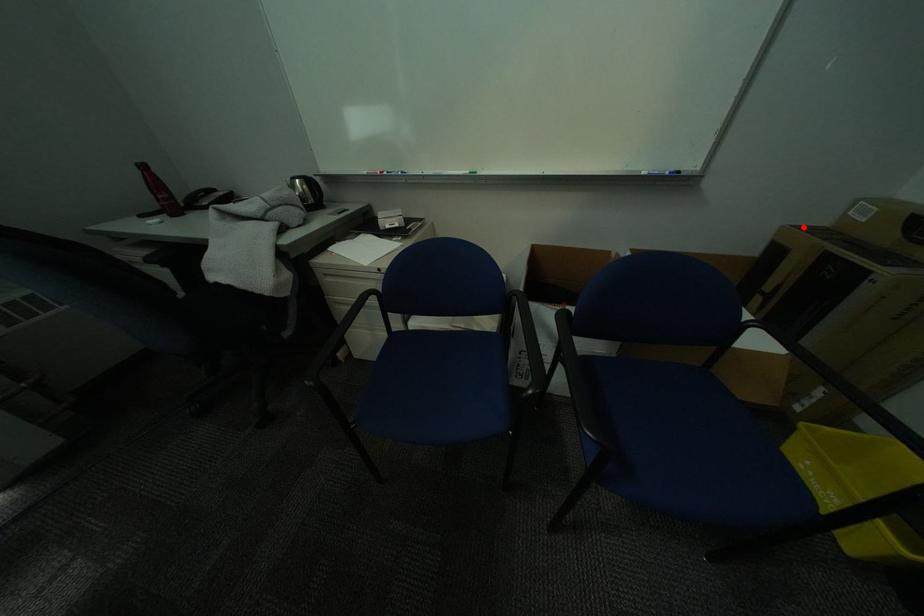
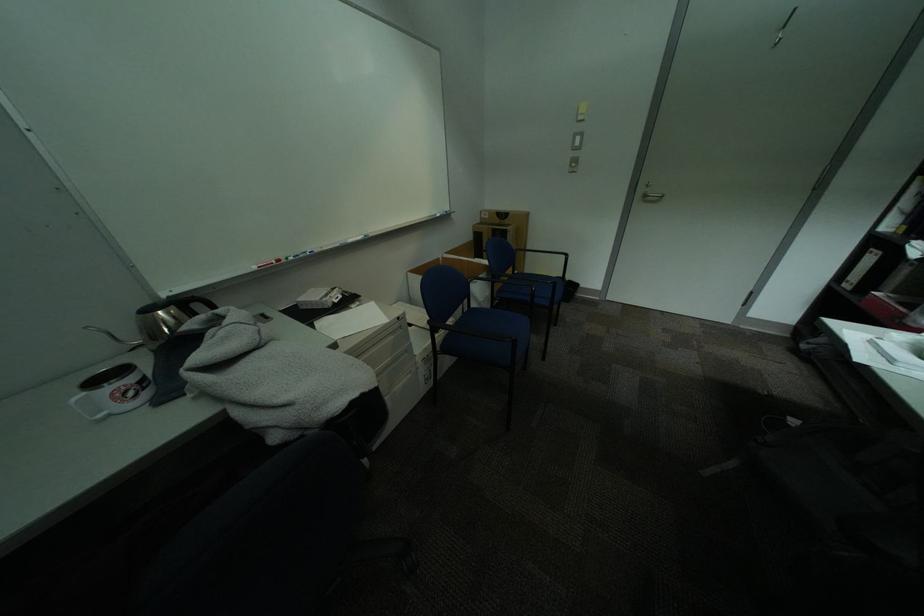
The point at the highlighted location is marked in the first image. Where is the corresponding point in the second image?

(487, 225)